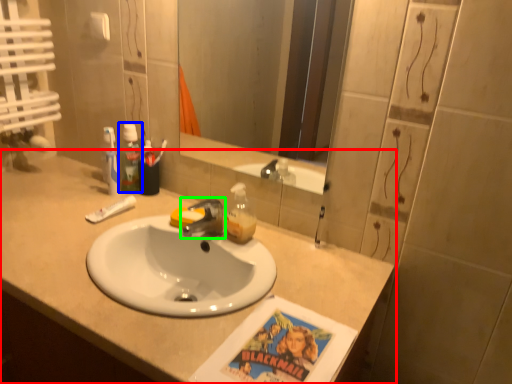
Question: Based on their relative distances, which object is farther from countertop (highlighted by a red box)? Choose from mouthwash (highlighted by a blue box) and tap (highlighted by a green box).

Choices:
 (A) mouthwash
 (B) tap

Answer: (A)